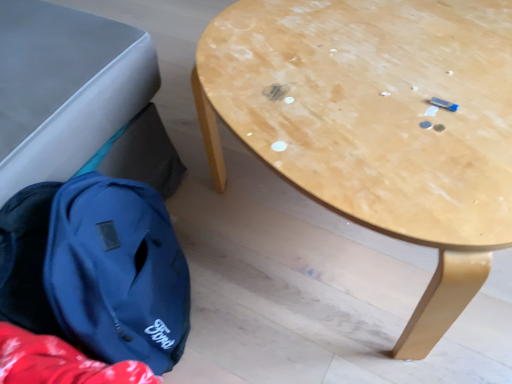
At what (x,y) coordinates should I click in order to perform the action: click on blank space situated above light brown wood table at center (from a real-world perspective). Please return your answer as a coordinate pair (x, y). Looking at the image, I should click on (375, 72).